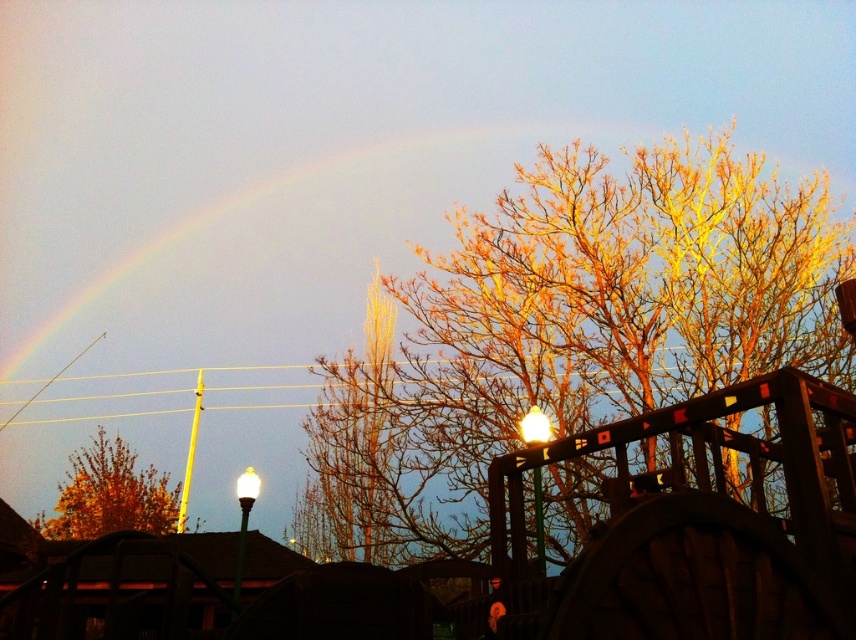
Question: Which object appears closest to the camera in this image?

Choices:
 (A) orange-brown textured tree at upper center
 (B) golden leafy tree at lower left

Answer: (A)

Question: Does rainbow at upper left appear on the left side of golden leafy tree at lower left?

Choices:
 (A) no
 (B) yes

Answer: (A)

Question: Which point appears farthest from the camera in this image?

Choices:
 (A) (78, 461)
 (B) (302, 518)

Answer: (A)

Question: Does orange-brown textured tree at upper center appear on the left side of golden leafy tree at lower left?

Choices:
 (A) yes
 (B) no

Answer: (B)

Question: Is orange-brown textured tree at upper center to the right of golden leafy tree at lower left from the viewer's perspective?

Choices:
 (A) yes
 (B) no

Answer: (A)

Question: Among these objects, which one is farthest from the camera?

Choices:
 (A) rainbow at upper left
 (B) golden leafy tree at lower left
 (C) orange-brown textured tree at upper center

Answer: (B)